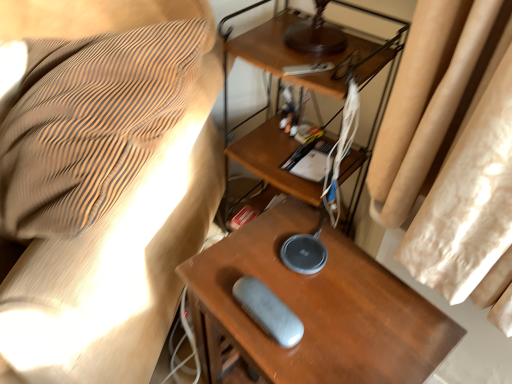
Question: Is gray fabric pouch at lower center taller or shorter than woodendesk at center?

Choices:
 (A) short
 (B) tall

Answer: (A)

Question: Would you say gray fabric pouch at lower center is to the left or to the right of woodendesk at center in the picture?

Choices:
 (A) left
 (B) right

Answer: (A)

Question: Estimate the real-world distances between objects in this image. Which object is closer to the wooden table at center?

Choices:
 (A) gray matte speaker at center
 (B) woodendesk at center
 (C) gray fabric pouch at lower center

Answer: (A)

Question: Which is farther from the gray matte speaker at center?

Choices:
 (A) gray fabric pouch at lower center
 (B) wooden table at center
 (C) woodendesk at center

Answer: (C)